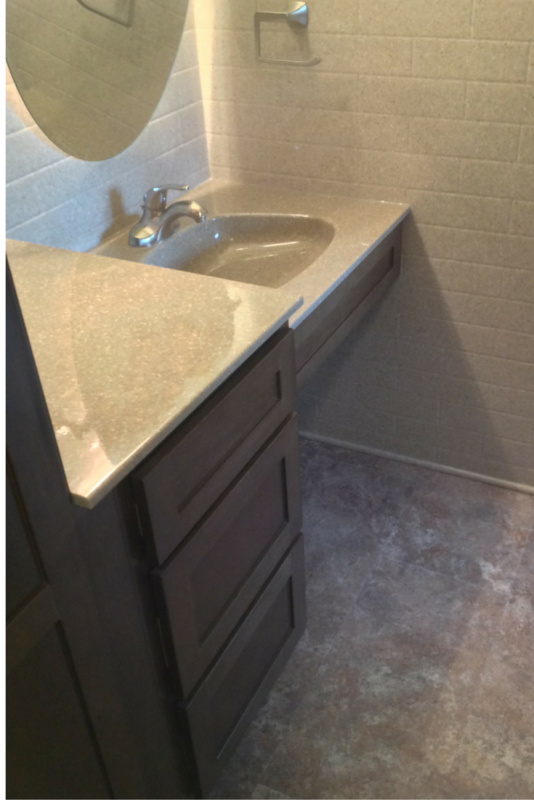
Where is `handle`? handle is located at coordinates (161, 190).